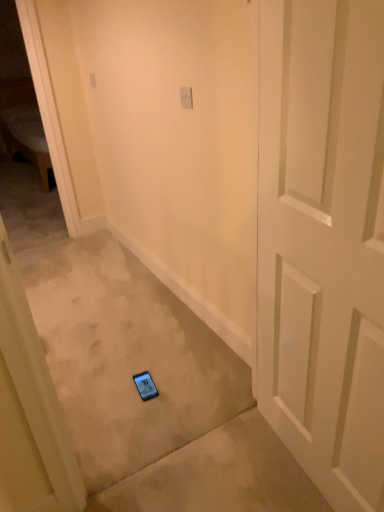
Question: Is white matte door at center facing away from white plastic light switch at upper center, the 2th light switch viewed from the front?

Choices:
 (A) yes
 (B) no

Answer: (B)

Question: Is there a large distance between white matte door at center and white plastic light switch at upper center, the 2th light switch viewed from the front?

Choices:
 (A) yes
 (B) no

Answer: (A)

Question: Considering the relative sizes of white matte door at center and white plastic light switch at upper center, which appears as the 1th light switch when viewed from the top, in the image provided, is white matte door at center thinner than white plastic light switch at upper center, which appears as the 1th light switch when viewed from the top,?

Choices:
 (A) no
 (B) yes

Answer: (A)

Question: Can you confirm if white matte door at center is wider than white plastic light switch at upper center, which is the second light switch in bottom-to-top order?

Choices:
 (A) no
 (B) yes

Answer: (B)

Question: Considering the relative sizes of white matte door at center and white plastic light switch at upper center, the 2th light switch viewed from the front, in the image provided, is white matte door at center taller than white plastic light switch at upper center, the 2th light switch viewed from the front,?

Choices:
 (A) yes
 (B) no

Answer: (A)

Question: Does white matte door at center turn towards white plastic light switch at upper center, which appears as the 1th light switch when viewed from the top?

Choices:
 (A) yes
 (B) no

Answer: (B)

Question: Does white plastic light switch at upper center, which ranks as the 2th light switch in top-to-bottom order, have a greater width compared to white matte door at center?

Choices:
 (A) yes
 (B) no

Answer: (B)

Question: Can you confirm if white plastic light switch at upper center, which ranks as the 2th light switch in top-to-bottom order, is positioned to the left of white matte door at center?

Choices:
 (A) no
 (B) yes

Answer: (B)

Question: Is white plastic light switch at upper center, which is the second light switch in left-to-right order, positioned in front of white matte door at center?

Choices:
 (A) no
 (B) yes

Answer: (A)

Question: Is white plastic light switch at upper center, which is counted as the first light switch, starting from the bottom, at the right side of white matte door at center?

Choices:
 (A) no
 (B) yes

Answer: (A)

Question: From the image's perspective, does white plastic light switch at upper center, positioned as the 1th light switch in front-to-back order, appear lower than white matte door at center?

Choices:
 (A) yes
 (B) no

Answer: (B)

Question: Does white plastic light switch at upper center, which is the second light switch in left-to-right order, have a greater height compared to white matte door at center?

Choices:
 (A) yes
 (B) no

Answer: (B)

Question: Considering the relative sizes of white plastic light switch at upper center, which ranks as the 1th light switch in left-to-right order, and white plastic light switch at upper center, which is the 2th light switch from back to front, in the image provided, is white plastic light switch at upper center, which ranks as the 1th light switch in left-to-right order, taller than white plastic light switch at upper center, which is the 2th light switch from back to front,?

Choices:
 (A) no
 (B) yes

Answer: (B)